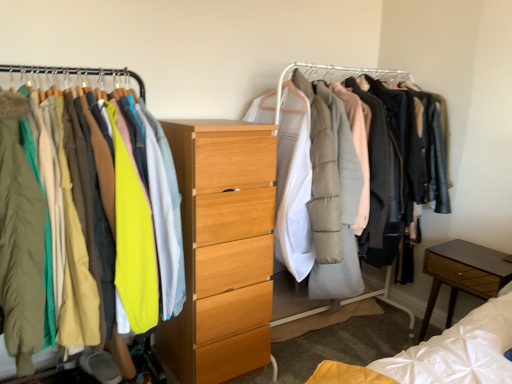
Question: Is matte white coat rack at center positioned with its back to matte green coat at left, the 1th clothing positioned from the front?

Choices:
 (A) no
 (B) yes

Answer: (A)

Question: From the image's perspective, is matte white coat rack at center located beneath matte green coat at left, the 1th clothing positioned from the front?

Choices:
 (A) no
 (B) yes

Answer: (B)

Question: Could you tell me if matte white coat rack at center is turned towards matte green coat at left, the 3th clothing when ordered from back to front?

Choices:
 (A) no
 (B) yes

Answer: (A)

Question: Is matte white coat rack at center to the right of matte green coat at left, the 3th clothing when ordered from back to front, from the viewer's perspective?

Choices:
 (A) no
 (B) yes

Answer: (B)

Question: Is matte white coat rack at center smaller than matte green coat at left, the 1th clothing positioned from the front?

Choices:
 (A) no
 (B) yes

Answer: (A)

Question: Is light wood chest of drawers at center taller or shorter than matte green coat at left, the 1th clothing positioned from the front?

Choices:
 (A) short
 (B) tall

Answer: (B)

Question: Is light wood chest of drawers at center spatially inside matte green coat at left, the 3th clothing when ordered from back to front, or outside of it?

Choices:
 (A) inside
 (B) outside

Answer: (B)

Question: From the image's perspective, is light wood chest of drawers at center above or below matte green coat at left, the 3th clothing when ordered from back to front?

Choices:
 (A) below
 (B) above

Answer: (A)

Question: Based on their sizes in the image, would you say light wood chest of drawers at center is bigger or smaller than matte green coat at left, the 1th clothing positioned from the front?

Choices:
 (A) big
 (B) small

Answer: (A)

Question: Is point (210, 258) closer or farther from the camera than point (145, 205)?

Choices:
 (A) closer
 (B) farther

Answer: (B)

Question: In terms of size, does light wood chest of drawers at center appear bigger or smaller than matte yellow jacket at left, the 3th clothing in the front-to-back sequence?

Choices:
 (A) big
 (B) small

Answer: (A)

Question: Looking at their shapes, would you say light wood chest of drawers at center is wider or thinner than matte yellow jacket at left, the 3th clothing in the front-to-back sequence?

Choices:
 (A) thin
 (B) wide

Answer: (A)

Question: From the image's perspective, is light wood chest of drawers at center positioned above or below matte yellow jacket at left, the 3th clothing in the front-to-back sequence?

Choices:
 (A) above
 (B) below

Answer: (B)

Question: Considering the positions of brown wood nightstand at lower right and light wood chest of drawers at center in the image, is brown wood nightstand at lower right bigger or smaller than light wood chest of drawers at center?

Choices:
 (A) small
 (B) big

Answer: (A)

Question: From a real-world perspective, is brown wood nightstand at lower right physically located above or below light wood chest of drawers at center?

Choices:
 (A) above
 (B) below

Answer: (B)